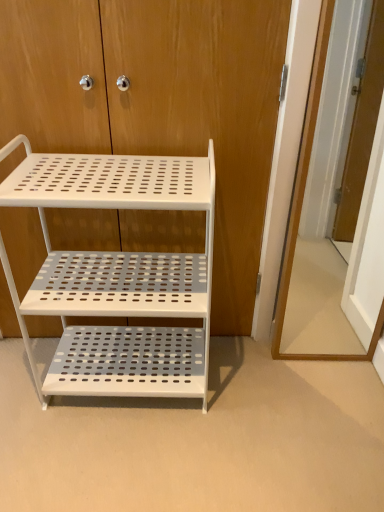
Question: From a real-world perspective, does white perforated metal shelf at center sit lower than white perforated metal shelf at center?

Choices:
 (A) yes
 (B) no

Answer: (A)

Question: Does white perforated metal shelf at center have a lesser width compared to white perforated metal shelf at center?

Choices:
 (A) no
 (B) yes

Answer: (A)

Question: Is white perforated metal shelf at center not within white perforated metal shelf at center?

Choices:
 (A) no
 (B) yes

Answer: (B)

Question: Considering the relative sizes of white perforated metal shelf at center and white perforated metal shelf at center in the image provided, is white perforated metal shelf at center bigger than white perforated metal shelf at center?

Choices:
 (A) yes
 (B) no

Answer: (A)

Question: Is white perforated metal shelf at center further to the viewer compared to white perforated metal shelf at center?

Choices:
 (A) yes
 (B) no

Answer: (B)

Question: Is white perforated metal shelf at center at the right side of white perforated metal shelf at center?

Choices:
 (A) no
 (B) yes

Answer: (A)

Question: Is white perforated metal shelf at center at the right side of wooden door at right?

Choices:
 (A) no
 (B) yes

Answer: (A)

Question: Considering the relative positions of white perforated metal shelf at center and wooden door at right in the image provided, is white perforated metal shelf at center to the left of wooden door at right from the viewer's perspective?

Choices:
 (A) yes
 (B) no

Answer: (A)

Question: Does white perforated metal shelf at center come in front of wooden door at right?

Choices:
 (A) yes
 (B) no

Answer: (A)

Question: Does white perforated metal shelf at center have a smaller size compared to wooden door at right?

Choices:
 (A) yes
 (B) no

Answer: (B)

Question: From a real-world perspective, is white perforated metal shelf at center on top of wooden door at right?

Choices:
 (A) yes
 (B) no

Answer: (B)

Question: Considering the relative sizes of white perforated metal shelf at center and wooden door at right in the image provided, is white perforated metal shelf at center wider than wooden door at right?

Choices:
 (A) yes
 (B) no

Answer: (A)

Question: Are wooden door at right and white perforated metal shelf at center far apart?

Choices:
 (A) no
 (B) yes

Answer: (A)